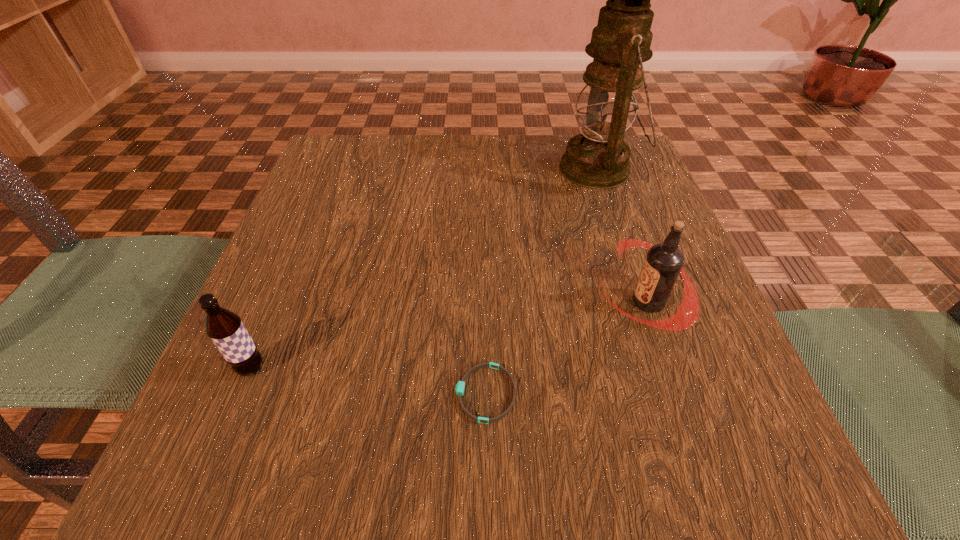
This screenshot has height=540, width=960. I want to click on vacant area situated 0.070m on the label of the right root beer, so click(x=560, y=302).

The height and width of the screenshot is (540, 960). I want to click on vacant position located on the label of the right root beer, so click(x=516, y=302).

Locate an element on the screen. vacant space located on the back of the left root beer is located at coordinates (304, 242).

The image size is (960, 540). Find the location of `blank space located on the buckle of the wristband`. blank space located on the buckle of the wristband is located at coordinates (243, 394).

What are the coordinates of `free region located on the buckle of the wristband` in the screenshot? It's located at (412, 394).

Where is `free space located on the buckle of the wristband`? Image resolution: width=960 pixels, height=540 pixels. free space located on the buckle of the wristband is located at coordinates [x=404, y=394].

Where is `object at the far edge`? Image resolution: width=960 pixels, height=540 pixels. object at the far edge is located at coordinates (598, 158).

This screenshot has height=540, width=960. In order to click on object present at the left edge in this screenshot , I will do `click(225, 328)`.

Where is `oil lamp at the right edge`? oil lamp at the right edge is located at coordinates (598, 158).

Find the location of `root beer that is at the right edge`. root beer that is at the right edge is located at coordinates (664, 261).